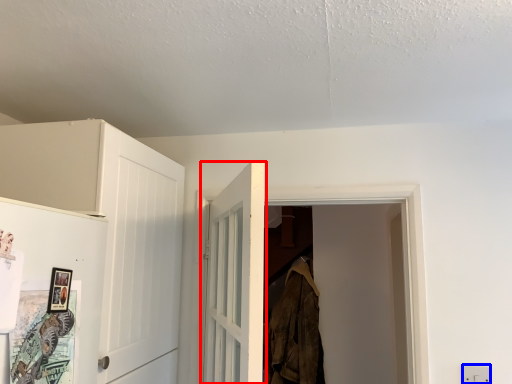
Question: Which point is further to the camera, door (highlighted by a red box) or electric outlet (highlighted by a blue box)?

Choices:
 (A) door
 (B) electric outlet

Answer: (B)